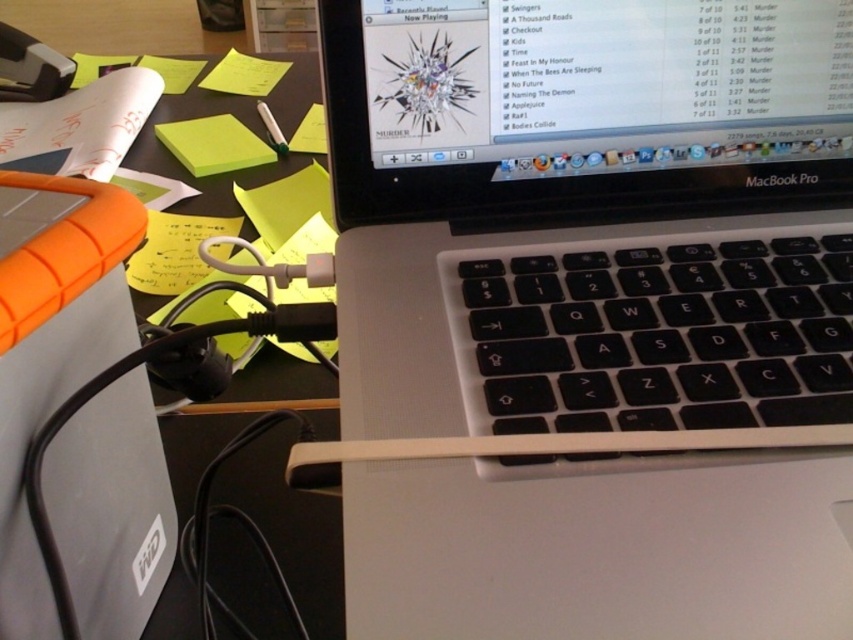
You are trying to reach the trackpad while holding a coffee cup in your right hand. Your hand is currently at the point marked as point (778,356). Given that the trackpad is 1.5 inches wide, will you be able to comfortably reach the trackpad without spilling your coffee?

The distance between your hand at point (778,356) and the trackpad is 13.41 inches, which is more than the trackpad width of 1.5 inches. Therefore, you may have difficulty reaching it comfortably without spilling your coffee.